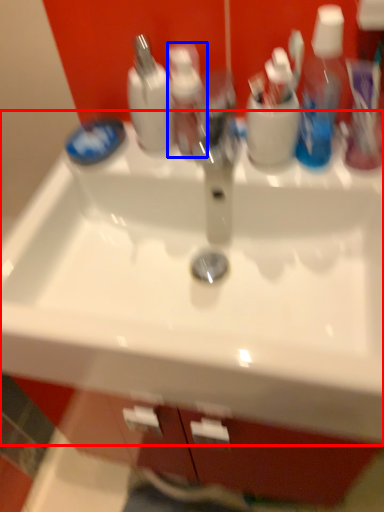
Question: Which object appears farthest to the camera in this image, sink (highlighted by a red box) or toiletry (highlighted by a blue box)?

Choices:
 (A) sink
 (B) toiletry

Answer: (B)